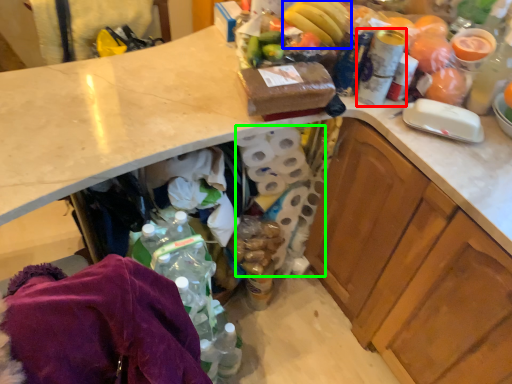
Question: Estimate the real-world distances between objects in this image. Which object is closer to bottle (highlighted by a red box), banana (highlighted by a blue box) or toilet paper (highlighted by a green box)?

Choices:
 (A) banana
 (B) toilet paper

Answer: (A)